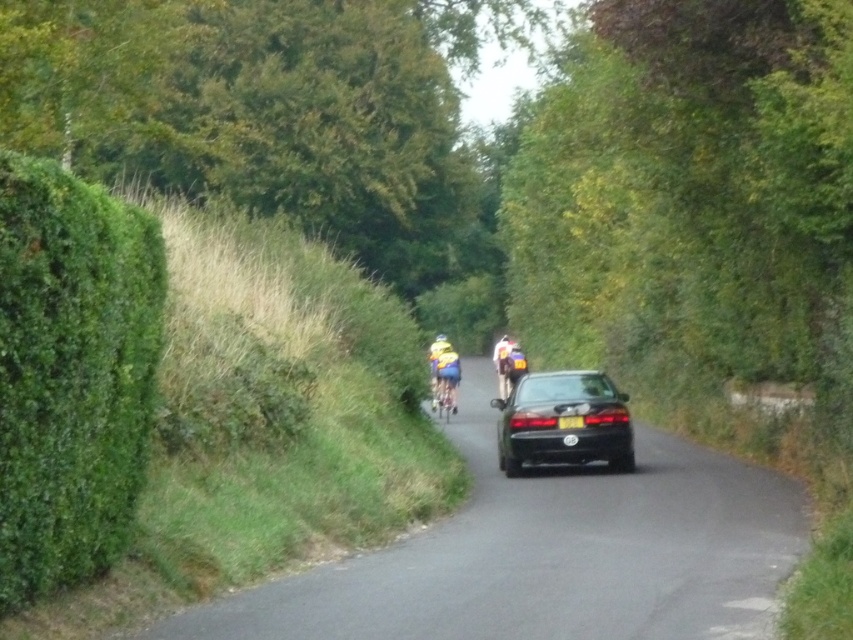
Question: Does green leafy hedge at left have a greater width compared to black glossy car at center?

Choices:
 (A) yes
 (B) no

Answer: (B)

Question: Can you confirm if black asphalt road at center is smaller than yellow matte helmet at center?

Choices:
 (A) no
 (B) yes

Answer: (A)

Question: Which point is closer to the camera?

Choices:
 (A) (440, 394)
 (B) (445, 394)
 (C) (527, 440)
 (D) (440, 340)

Answer: (C)

Question: Which object is positioned farthest from the green leafy hedge at left?

Choices:
 (A) yellow fabric cyclist at center
 (B) yellow matte helmet at center

Answer: (B)

Question: Which object appears closest to the camera in this image?

Choices:
 (A) black glossy car at center
 (B) yellow fabric helmet at center
 (C) black asphalt road at center

Answer: (C)

Question: Can you confirm if yellow fabric cyclist at center is bigger than yellow fabric bicycle at center?

Choices:
 (A) no
 (B) yes

Answer: (A)